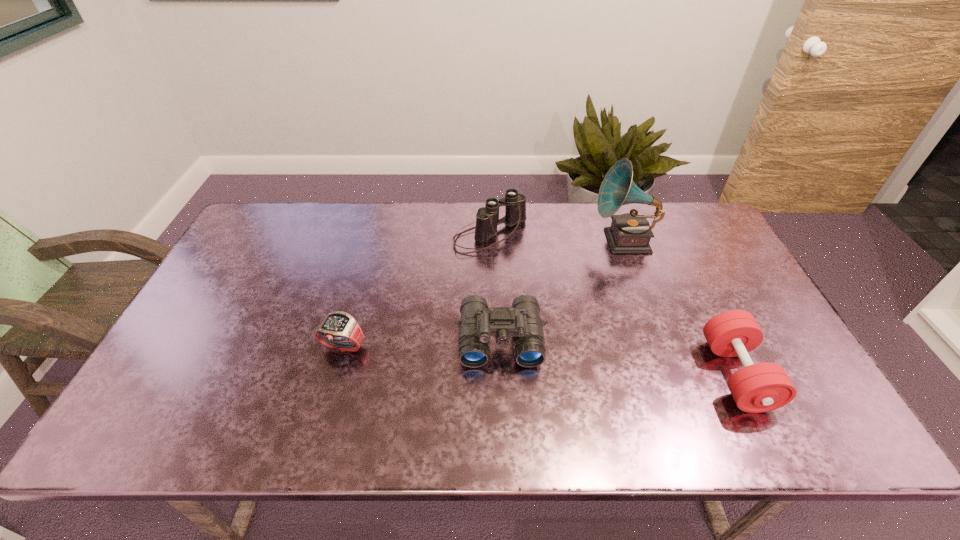
In the image, there is a desktop. In order to click on free space at the left edge in this screenshot , I will do `click(204, 299)`.

Where is `free space at the right edge`? free space at the right edge is located at coordinates (702, 271).

This screenshot has height=540, width=960. In order to click on free region at the far right corner of the desktop in this screenshot , I will do `click(701, 212)`.

This screenshot has height=540, width=960. What are the coordinates of `free space that is in between the nearer binoculars and the tallest object` in the screenshot? It's located at (562, 291).

At what (x,y) coordinates should I click in order to perform the action: click on free space between the dumbbell and the nearer binoculars. Please return your answer as a coordinate pair (x, y). The height and width of the screenshot is (540, 960). Looking at the image, I should click on (618, 357).

The height and width of the screenshot is (540, 960). I want to click on vacant space in between the farther binoculars and the tallest object, so click(x=557, y=239).

Identify the location of vacant space in between the shortest object and the tallest object. This screenshot has height=540, width=960. (483, 294).

Where is `vacant point located between the tallest object and the nearer binoculars`? The height and width of the screenshot is (540, 960). vacant point located between the tallest object and the nearer binoculars is located at coordinates (562, 291).

You are a GUI agent. You are given a task and a screenshot of the screen. Output one action in this format:
    pyautogui.click(x=<x>, y=<y>)
    Task: Click on the vacant space that is in between the phonograph_record and the nearer binoculars
    
    Given the screenshot: What is the action you would take?
    pyautogui.click(x=562, y=291)

Identify the location of vacant area that lies between the watch and the nearer binoculars. (421, 343).